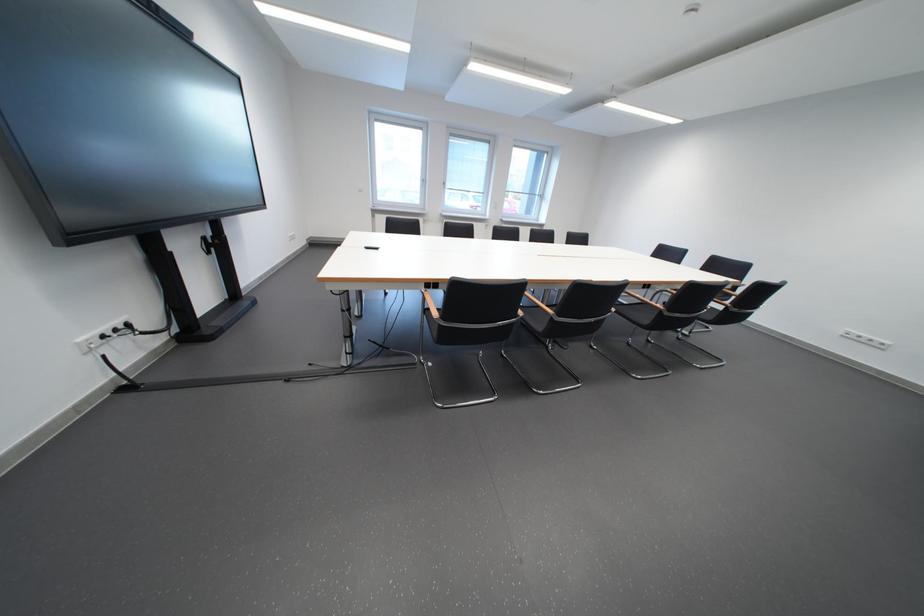
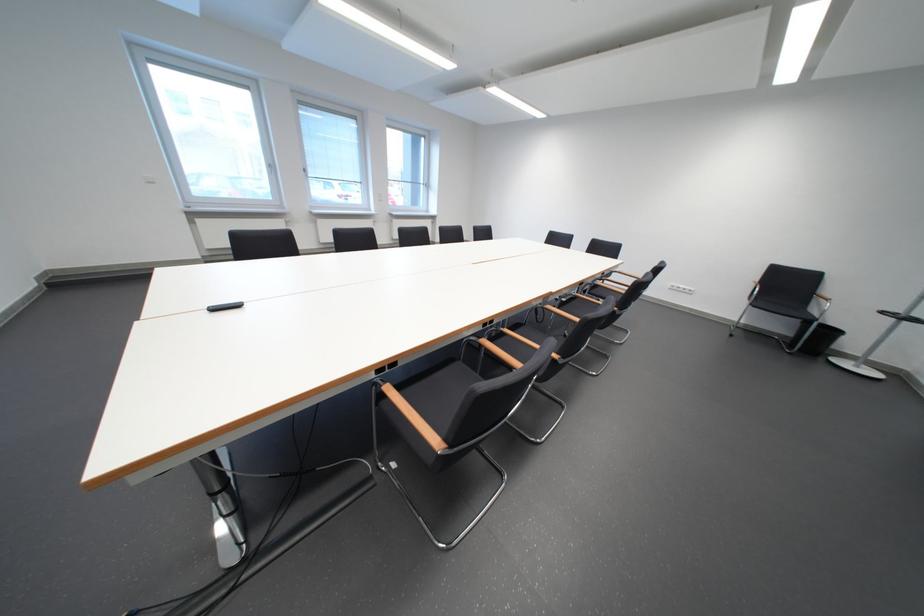
Question: The images are taken continuously from a first-person perspective. In which direction is your viewpoint rotating?

Choices:
 (A) Left
 (B) Right
 (C) Up
 (D) Down

Answer: (B)